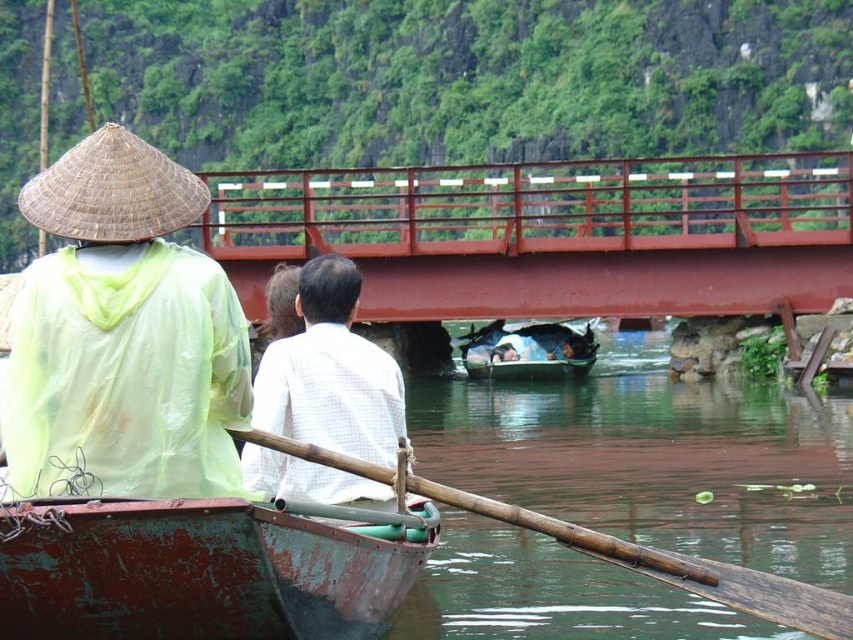
Question: Does white checkered shirt at center appear under braided straw hat at upper left?

Choices:
 (A) yes
 (B) no

Answer: (A)

Question: Considering the real-world distances, which object is farthest from the rusty metal canoe at lower left?

Choices:
 (A) red metal bridge at center
 (B) wooden boat at center
 (C) brown bamboo paddle at lower center
 (D) green translucent raincoat at upper left

Answer: (B)

Question: Does red metal bridge at center appear on the right side of green translucent raincoat at upper left?

Choices:
 (A) no
 (B) yes

Answer: (B)

Question: Among these objects, which one is nearest to the camera?

Choices:
 (A) braided straw hat at upper left
 (B) brown bamboo paddle at lower center
 (C) green translucent raincoat at upper left
 (D) red metal bridge at center

Answer: (B)

Question: Which point appears closest to the camera in this image?

Choices:
 (A) (665, 204)
 (B) (379, 445)
 (C) (444, 497)

Answer: (C)

Question: Is green translucent raincoat at upper left smaller than wooden boat at center?

Choices:
 (A) yes
 (B) no

Answer: (A)